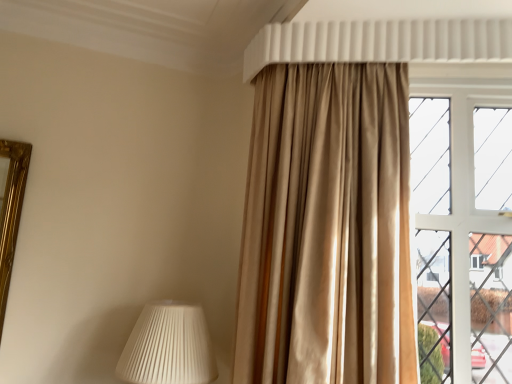
Question: From a real-world perspective, is satin beige curtain at upper right above or below white plastic shutter at upper center?

Choices:
 (A) above
 (B) below

Answer: (B)

Question: Is point (361, 350) closer or farther from the camera than point (488, 36)?

Choices:
 (A) farther
 (B) closer

Answer: (B)

Question: Considering the real-world distances, which object is farthest from the satin beige curtain at upper right?

Choices:
 (A) white pleated lampshade at lower left
 (B) white glass window at right
 (C) white plastic shutter at upper center

Answer: (C)

Question: Which object is positioned farthest from the white plastic shutter at upper center?

Choices:
 (A) white pleated lampshade at lower left
 (B) satin beige curtain at upper right
 (C) white glass window at right

Answer: (A)